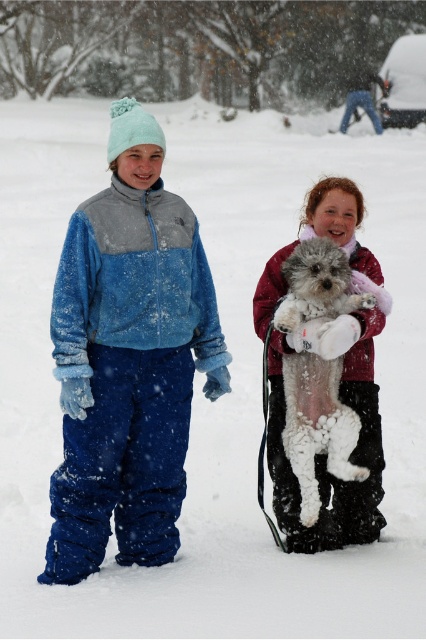
You are a GUI agent. You are given a task and a screenshot of the screen. Output one action in this format:
    pyautogui.click(x=<x>, y=<y>)
    Task: Click on the fuzzy blue snowsuit at left
    The image size is (426, 640).
    Given the screenshot: What is the action you would take?
    pyautogui.click(x=127, y=358)

This screenshot has height=640, width=426. What do you see at coordinates (127, 358) in the screenshot? I see `fuzzy blue snowsuit at left` at bounding box center [127, 358].

Locate an element on the screen. This screenshot has height=640, width=426. fuzzy blue snowsuit at left is located at coordinates (127, 358).